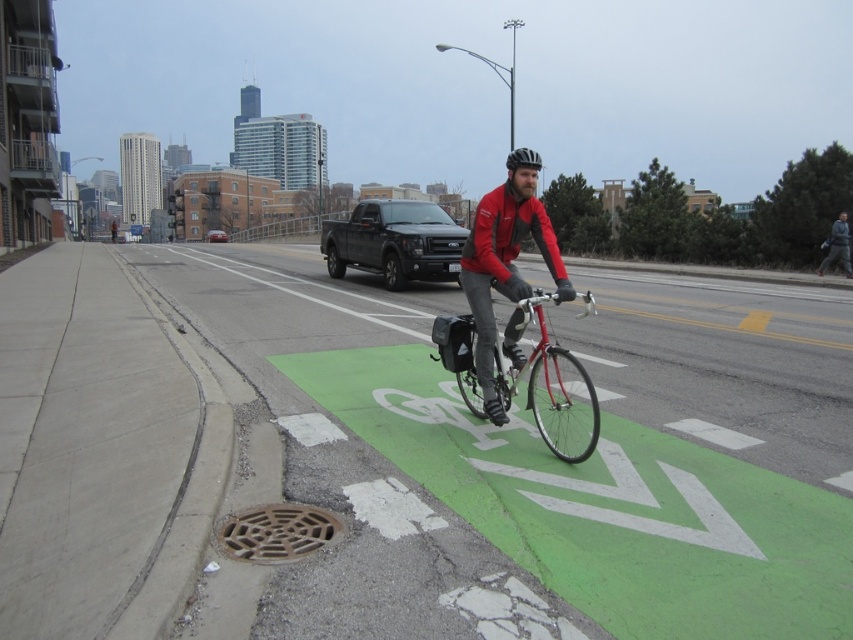
Question: Can you confirm if green painted bike lane at center is thinner than metallic silver truck at center?

Choices:
 (A) yes
 (B) no

Answer: (B)

Question: Among these objects, which one is nearest to the camera?

Choices:
 (A) matte black truck at center
 (B) green painted bike lane at center
 (C) brown textured manhole cover at lower left

Answer: (B)

Question: Does brown textured manhole cover at lower left have a smaller size compared to black matte helmet at center?

Choices:
 (A) no
 (B) yes

Answer: (B)

Question: Which point is closer to the camera taking this photo?

Choices:
 (A) (370, 200)
 (B) (268, 522)
 (C) (534, 349)

Answer: (B)

Question: Which point appears closest to the camera in this image?

Choices:
 (A) (399, 218)
 (B) (540, 161)

Answer: (B)

Question: Is shiny metallic bicycle at center bigger than black matte helmet at center?

Choices:
 (A) yes
 (B) no

Answer: (B)